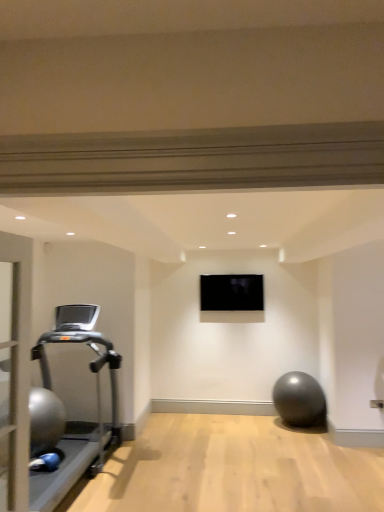
Describe the element at coordinates (231, 293) in the screenshot. The image size is (384, 512). I see `black glossy tv at center` at that location.

The height and width of the screenshot is (512, 384). Find the location of `black glossy tv at center`. black glossy tv at center is located at coordinates (231, 293).

Measure the distance between point (81,443) and camera.

Point (81,443) and camera are 4.16 meters apart from each other.

What is the approximate width of silver metallic treadmill at left?

silver metallic treadmill at left is 3.67 feet wide.

Image resolution: width=384 pixels, height=512 pixels. What do you see at coordinates (64, 409) in the screenshot?
I see `silver metallic treadmill at left` at bounding box center [64, 409].

Locate an element on the screen. The image size is (384, 512). silver metallic treadmill at left is located at coordinates (64, 409).

Where is `black glossy tv at center`? The height and width of the screenshot is (512, 384). black glossy tv at center is located at coordinates (231, 293).

Based on their positions, is black glossy tv at center located to the left or right of silver metallic treadmill at left?

black glossy tv at center is positioned on silver metallic treadmill at left's right side.

Between black glossy tv at center and silver metallic treadmill at left, which one is positioned behind?

black glossy tv at center is behind.

Does point (220, 294) come farther from viewer compared to point (69, 429)?

Yes, point (220, 294) is farther from viewer.

From the image's perspective, is black glossy tv at center beneath silver metallic treadmill at left?

No.

From a real-world perspective, is black glossy tv at center physically located above or below silver metallic treadmill at left?

From a real-world perspective, black glossy tv at center is physically above silver metallic treadmill at left.

Does black glossy tv at center have a greater width compared to silver metallic treadmill at left?

No.

Is black glossy tv at center taller or shorter than silver metallic treadmill at left?

In the image, black glossy tv at center appears to be shorter than silver metallic treadmill at left.

Considering the relative sizes of black glossy tv at center and silver metallic treadmill at left in the image provided, is black glossy tv at center smaller than silver metallic treadmill at left?

Indeed, black glossy tv at center has a smaller size compared to silver metallic treadmill at left.

Is black glossy tv at center located outside silver metallic treadmill at left?

black glossy tv at center is positioned outside silver metallic treadmill at left.

Is black glossy tv at center far away from silver metallic treadmill at left?

Yes.

Is black glossy tv at center positioned with its back to silver metallic treadmill at left?

No, black glossy tv at center is not facing away from silver metallic treadmill at left.

Can you tell me how much black glossy tv at center and silver metallic treadmill at left differ in facing direction?

The angle between the facing direction of black glossy tv at center and the facing direction of silver metallic treadmill at left is 90.9 degrees.

You are a GUI agent. You are given a task and a screenshot of the screen. Output one action in this format:
    pyautogui.click(x=<x>, y=<y>)
    Task: Click on the projection screen above the silver metallic treadmill at left (from the image's perspective)
    The width and height of the screenshot is (384, 512).
    Given the screenshot: What is the action you would take?
    pyautogui.click(x=231, y=293)

Which object is positioned more to the right, silver metallic treadmill at left or black glossy tv at center?

black glossy tv at center is more to the right.

Is silver metallic treadmill at left positioned in front of black glossy tv at center?

Yes, silver metallic treadmill at left is closer to the viewer.

Which is more distant, (97, 308) or (212, 306)?

The point (212, 306) is behind.

From the image's perspective, is silver metallic treadmill at left on black glossy tv at center?

No.

From a real-world perspective, which is physically above, silver metallic treadmill at left or black glossy tv at center?

black glossy tv at center, from a real-world perspective.

Consider the image. Can you confirm if silver metallic treadmill at left is wider than black glossy tv at center?

Indeed, silver metallic treadmill at left has a greater width compared to black glossy tv at center.

Considering the relative sizes of silver metallic treadmill at left and black glossy tv at center in the image provided, is silver metallic treadmill at left shorter than black glossy tv at center?

No, silver metallic treadmill at left is not shorter than black glossy tv at center.

In terms of size, does silver metallic treadmill at left appear bigger or smaller than black glossy tv at center?

In the image, silver metallic treadmill at left appears to be larger than black glossy tv at center.

Is silver metallic treadmill at left not inside black glossy tv at center?

silver metallic treadmill at left lies outside black glossy tv at center's area.

Would you say silver metallic treadmill at left is a long distance from black glossy tv at center?

That's right, there is a large distance between silver metallic treadmill at left and black glossy tv at center.

Does silver metallic treadmill at left turn towards black glossy tv at center?

No.

What's the angular difference between silver metallic treadmill at left and black glossy tv at center's facing directions?

silver metallic treadmill at left and black glossy tv at center are facing 90.9 degrees away from each other.

Identify the location of treadmill below the black glossy tv at center (from the image's perspective). (64, 409).

In order to click on treadmill lying on the left of black glossy tv at center in this screenshot , I will do `click(64, 409)`.

This screenshot has height=512, width=384. I want to click on treadmill in front of the black glossy tv at center, so click(64, 409).